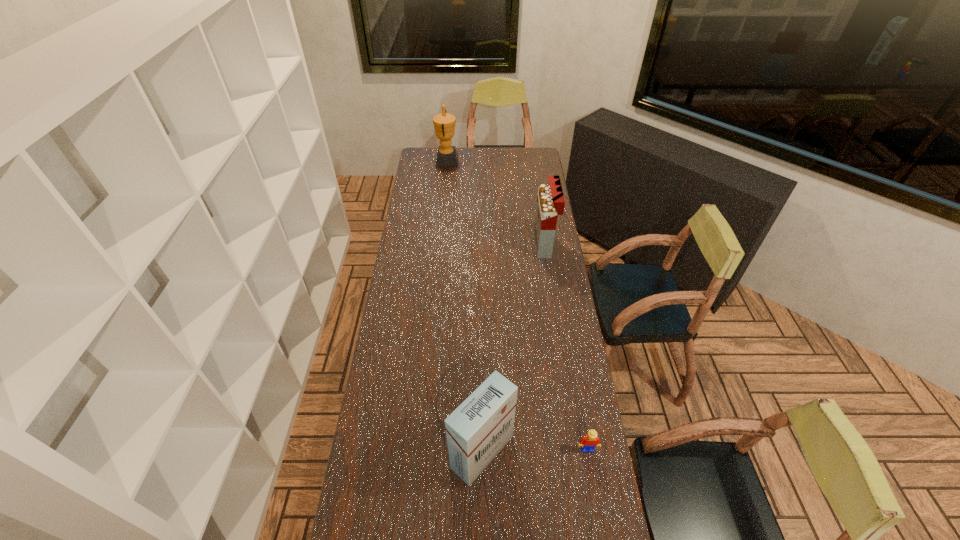
In the image, there is a desktop. Where is `vacant space at the right edge`? This screenshot has width=960, height=540. vacant space at the right edge is located at coordinates (562, 458).

The width and height of the screenshot is (960, 540). I want to click on free space between the Lego and the farthest object, so click(x=516, y=305).

The image size is (960, 540). I want to click on vacant space that's between the nearer cigarette case and the shortest object, so click(x=535, y=450).

You are a GUI agent. You are given a task and a screenshot of the screen. Output one action in this format:
    pyautogui.click(x=<x>, y=<y>)
    Task: Click on the empty space between the Lego and the third nearest object
    
    Given the screenshot: What is the action you would take?
    pyautogui.click(x=565, y=346)

At what (x,y) coordinates should I click in order to perform the action: click on free space between the farthest object and the third object from right to left. Please return your answer as a coordinate pair (x, y). The width and height of the screenshot is (960, 540). Looking at the image, I should click on (465, 306).

Where is `free area in between the farthest object and the Lego`? Image resolution: width=960 pixels, height=540 pixels. free area in between the farthest object and the Lego is located at coordinates (516, 305).

The image size is (960, 540). I want to click on vacant space in between the left cigarette case and the farthest object, so click(465, 306).

In order to click on unoccupied position between the left cigarette case and the Lego in this screenshot , I will do `click(535, 450)`.

Find the location of `the second closest object to the left cigarette case`. the second closest object to the left cigarette case is located at coordinates (550, 200).

Choose which object is the third nearest neighbor to the award. Please provide its 2D coordinates. Your answer should be formatted as a tuple, i.e. [(x, y)], where the tuple contains the x and y coordinates of a point satisfying the conditions above.

[(587, 443)]